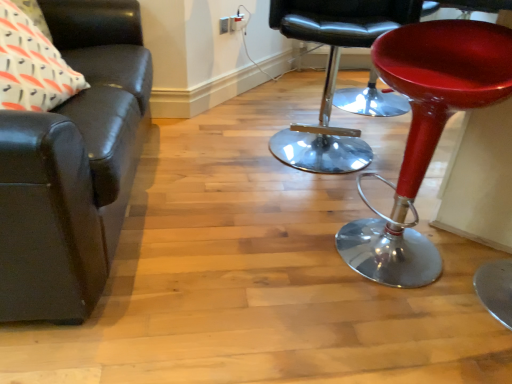
Question: Is shiny red stool at right not within shiny chrome stool at center, placed as the 2th chair when sorted from left to right?

Choices:
 (A) no
 (B) yes

Answer: (B)

Question: Is shiny red stool at right facing towards shiny chrome stool at center, marked as the 1th chair in a right-to-left arrangement?

Choices:
 (A) yes
 (B) no

Answer: (A)

Question: From a real-world perspective, is shiny red stool at right on shiny chrome stool at center, marked as the 1th chair in a right-to-left arrangement?

Choices:
 (A) yes
 (B) no

Answer: (A)

Question: Does shiny red stool at right contain shiny chrome stool at center, placed as the 2th chair when sorted from left to right?

Choices:
 (A) no
 (B) yes

Answer: (A)

Question: Does shiny red stool at right lie behind shiny chrome stool at center, marked as the 1th chair in a right-to-left arrangement?

Choices:
 (A) no
 (B) yes

Answer: (A)

Question: Is shiny chrome stool at center, placed as the 2th chair when sorted from left to right, wider or thinner than matte black leather couch at left, which is the second chair from right to left?

Choices:
 (A) wide
 (B) thin

Answer: (B)

Question: From the image's perspective, is shiny chrome stool at center, marked as the 1th chair in a right-to-left arrangement, positioned above or below matte black leather couch at left, which is counted as the 1th chair, starting from the left?

Choices:
 (A) below
 (B) above

Answer: (B)

Question: From a real-world perspective, is shiny chrome stool at center, marked as the 1th chair in a right-to-left arrangement, physically located above or below matte black leather couch at left, which is counted as the 1th chair, starting from the left?

Choices:
 (A) below
 (B) above

Answer: (A)

Question: Is shiny chrome stool at center, placed as the 2th chair when sorted from left to right, taller or shorter than matte black leather couch at left, which is counted as the 1th chair, starting from the left?

Choices:
 (A) short
 (B) tall

Answer: (A)

Question: From the image's perspective, is shiny red stool at right located above or below white printed fabric pillow at upper left?

Choices:
 (A) below
 (B) above

Answer: (A)

Question: Looking at their shapes, would you say shiny red stool at right is wider or thinner than white printed fabric pillow at upper left?

Choices:
 (A) wide
 (B) thin

Answer: (A)

Question: Do you think shiny red stool at right is within white printed fabric pillow at upper left, or outside of it?

Choices:
 (A) outside
 (B) inside

Answer: (A)

Question: Considering their positions, is shiny red stool at right located in front of or behind white printed fabric pillow at upper left?

Choices:
 (A) front
 (B) behind

Answer: (A)

Question: Considering the positions of matte black leather couch at left, which is counted as the 1th chair, starting from the left, and shiny chrome stool at center, placed as the 2th chair when sorted from left to right, in the image, is matte black leather couch at left, which is counted as the 1th chair, starting from the left, wider or thinner than shiny chrome stool at center, placed as the 2th chair when sorted from left to right,?

Choices:
 (A) thin
 (B) wide

Answer: (B)

Question: Is point (89, 228) positioned closer to the camera than point (412, 16)?

Choices:
 (A) farther
 (B) closer

Answer: (B)